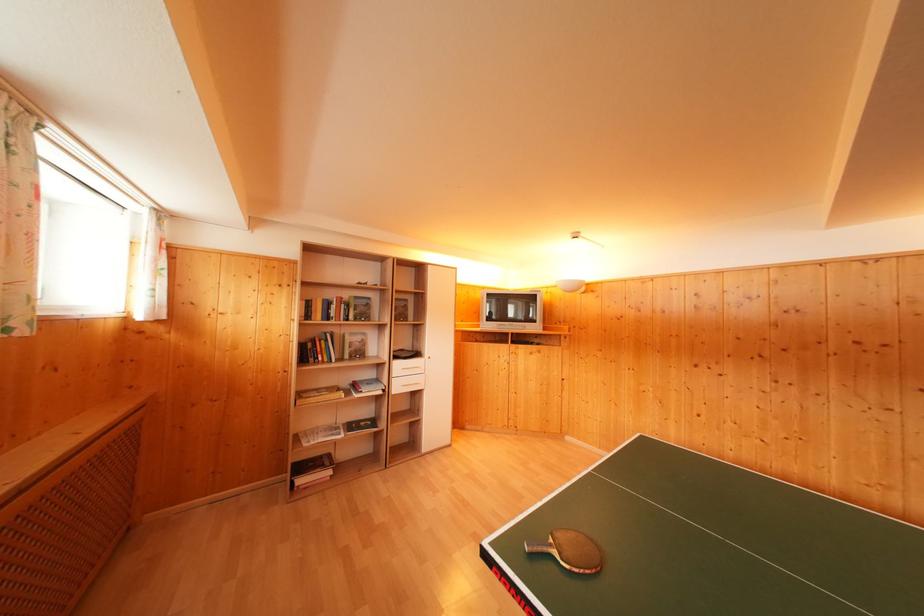
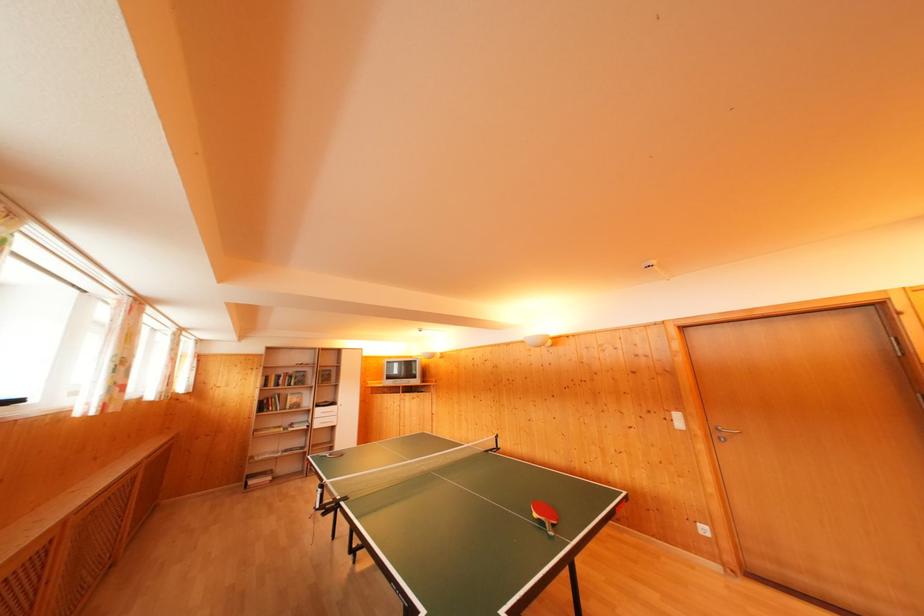
In the second image, find the point that corresponds to pixel 311 359 in the first image.

(268, 411)